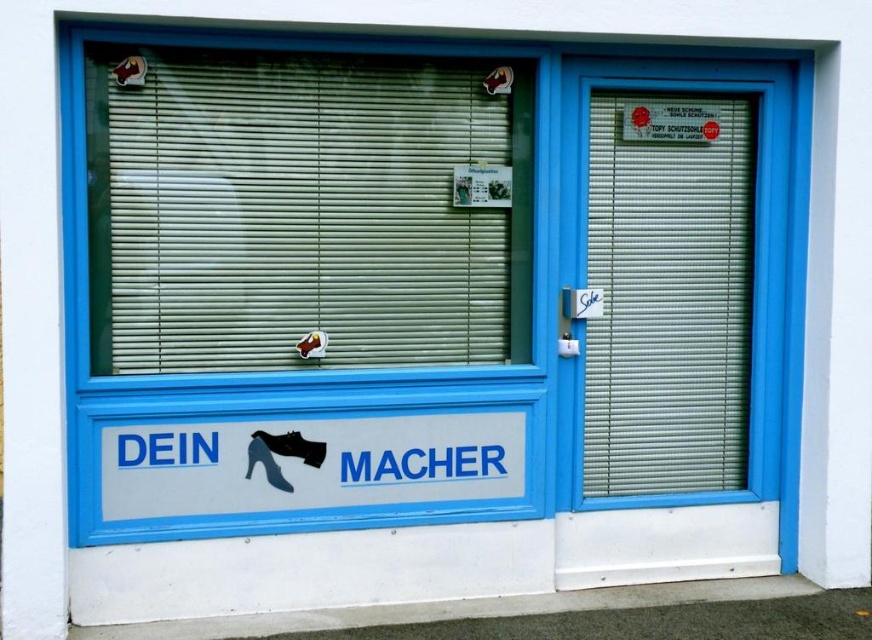
You are a delivery person trying to see through the window to check if the store is open. The green matte blinds at center and the white plastic shutter at right are blocking your view. Which object should you adjust to get a better view?

The green matte blinds at center is shorter than the white plastic shutter at right, so adjusting the green matte blinds at center might allow you to see through the window better since it is lower and closer to your line of sight.

You are a delivery person trying to determine the best way to enter the store. You notice the green matte blinds at center and the white plastic shutter at right. Which object is positioned closer to the left side of the storefront?

The green matte blinds at center is positioned to the left of the white plastic shutter at right, so it is closer to the left side of the storefront.